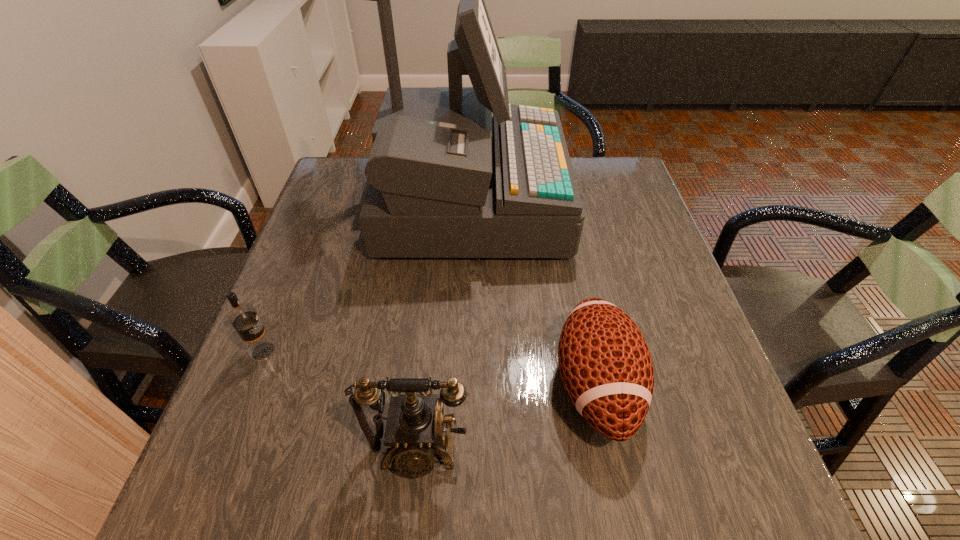
This screenshot has height=540, width=960. In order to click on free space at the near left corner of the desktop in this screenshot , I will do `click(264, 473)`.

This screenshot has height=540, width=960. In order to click on vacant region at the far right corner of the desktop in this screenshot , I will do `click(597, 160)`.

Where is `free space between the cash register and the third shortest object`? Image resolution: width=960 pixels, height=540 pixels. free space between the cash register and the third shortest object is located at coordinates (443, 325).

The width and height of the screenshot is (960, 540). I want to click on vacant region between the farthest object and the third shortest object, so click(x=443, y=325).

Where is `vacant area that lies between the football and the vodka`? vacant area that lies between the football and the vodka is located at coordinates click(430, 368).

This screenshot has height=540, width=960. What are the coordinates of `free spot between the tallest object and the football` in the screenshot? It's located at (532, 294).

The image size is (960, 540). I want to click on empty location between the cash register and the vodka, so click(366, 276).

Where is `empty space that is in between the football and the third shortest object`? empty space that is in between the football and the third shortest object is located at coordinates (507, 417).

Locate an element on the screen. blank region between the football and the telephone is located at coordinates 507,417.

Image resolution: width=960 pixels, height=540 pixels. I want to click on vacant region between the cash register and the football, so click(x=532, y=294).